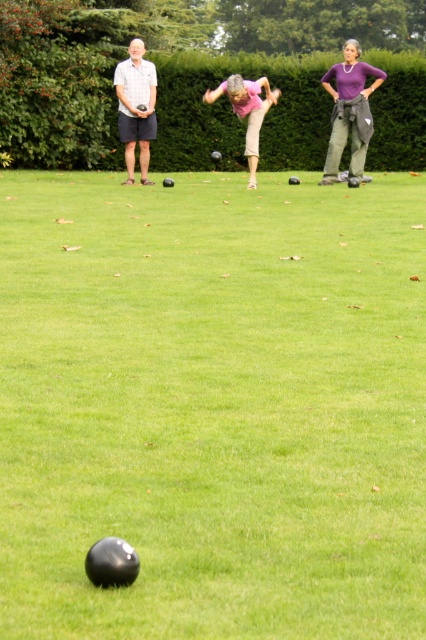
Who is more distant from viewer, (405, 524) or (259, 104)?

Positioned behind is point (259, 104).

I want to click on green grass at center, so click(213, 406).

Identify the location of green grass at center. (x=213, y=406).

Which is behind, point (150, 74) or point (213, 92)?

The point (213, 92) is more distant.

Is matte gray shorts at left to the left of pink fabric pants at center from the viewer's perspective?

Indeed, matte gray shorts at left is positioned on the left side of pink fabric pants at center.

Image resolution: width=426 pixels, height=640 pixels. What do you see at coordinates (135, 108) in the screenshot? I see `matte gray shorts at left` at bounding box center [135, 108].

The width and height of the screenshot is (426, 640). I want to click on matte gray shorts at left, so click(x=135, y=108).

Is purple matte shirt at upper right to the left of pink fabric pants at center from the viewer's perspective?

In fact, purple matte shirt at upper right is to the right of pink fabric pants at center.

Image resolution: width=426 pixels, height=640 pixels. What are the coordinates of `purple matte shirt at upper right` in the screenshot? It's located at (350, 113).

Where is `purple matte shirt at upper right`? This screenshot has width=426, height=640. purple matte shirt at upper right is located at coordinates (350, 113).